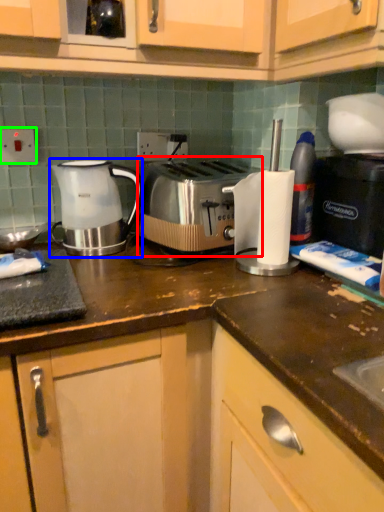
Question: Which object is the farthest from toaster (highlighted by a red box)? Choose among these: kettle (highlighted by a blue box) or electric outlet (highlighted by a green box).

Choices:
 (A) kettle
 (B) electric outlet

Answer: (B)